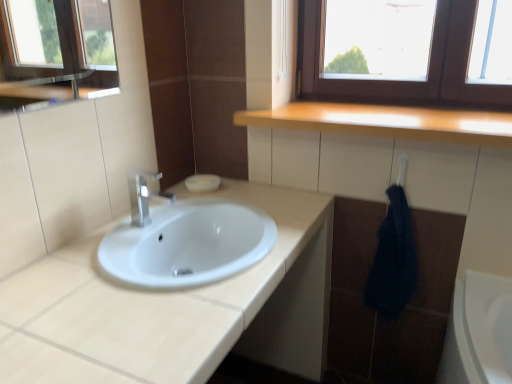
Where is `satin nickel faucet at center`? The height and width of the screenshot is (384, 512). satin nickel faucet at center is located at coordinates (144, 195).

What is the approximate width of light wood countertop at upper center?

It is 40.02 centimeters.

Locate an element on the screen. This screenshot has width=512, height=384. dark blue textured towel at right is located at coordinates (393, 260).

Is white glossy sink at center oriented towards satin nickel faucet at center?

No, white glossy sink at center is not turned towards satin nickel faucet at center.

Can you confirm if white glossy sink at center is bigger than satin nickel faucet at center?

Indeed, white glossy sink at center has a larger size compared to satin nickel faucet at center.

Which object is thinner, white glossy sink at center or satin nickel faucet at center?

satin nickel faucet at center.

Which is closer, (403, 298) or (140, 199)?

Point (403, 298) is farther from the camera than point (140, 199).

Can you confirm if dark blue textured towel at right is positioned to the left of satin nickel faucet at center?

No.

From the image's perspective, is dark blue textured towel at right above satin nickel faucet at center?

Incorrect, from the image's perspective, dark blue textured towel at right is lower than satin nickel faucet at center.

Is dark blue textured towel at right at the back of light wood countertop at upper center?

No, light wood countertop at upper center is not facing away from dark blue textured towel at right.

Who is taller, light wood countertop at upper center or dark blue textured towel at right?

dark blue textured towel at right is taller.

Is dark blue textured towel at right inside light wood countertop at upper center?

No, light wood countertop at upper center does not contain dark blue textured towel at right.

The height and width of the screenshot is (384, 512). I want to click on bath towel located behind the light wood countertop at upper center, so click(x=393, y=260).

Considering the relative positions of white glossy sink at center and light wood countertop at upper center in the image provided, is white glossy sink at center in front of light wood countertop at upper center?

Yes, it is in front of light wood countertop at upper center.

Who is smaller, white glossy sink at center or light wood countertop at upper center?

Smaller between the two is light wood countertop at upper center.

Between point (311, 351) and point (493, 118), which one is positioned in front?

The point (493, 118) is closer.

From a real-world perspective, between white glossy sink at center and light wood countertop at upper center, who is vertically higher?

In real-world perspective, light wood countertop at upper center is above.

Is satin nickel faucet at center inside the boundaries of light wood countertop at upper center, or outside?

satin nickel faucet at center lies outside light wood countertop at upper center.

Is satin nickel faucet at center next to light wood countertop at upper center and touching it?

No, satin nickel faucet at center is not with light wood countertop at upper center.

Who is more distant, satin nickel faucet at center or light wood countertop at upper center?

satin nickel faucet at center.

In the scene shown: Is light wood countertop at upper center bigger than satin nickel faucet at center?

Yes.

The width and height of the screenshot is (512, 384). What are the coordinates of `countertop in front of the satin nickel faucet at center` in the screenshot? It's located at point(387,122).

How much distance is there between light wood countertop at upper center and satin nickel faucet at center?

light wood countertop at upper center and satin nickel faucet at center are 27.84 inches apart.

How different are the orientations of light wood countertop at upper center and satin nickel faucet at center in degrees?

They differ by 88.7 degrees in their facing directions.

From the image's perspective, is light wood countertop at upper center located beneath white glossy sink at center?

No.

What's the angular difference between light wood countertop at upper center and white glossy sink at center's facing directions?

89.8 degrees.

Is light wood countertop at upper center taller or shorter than white glossy sink at center?

light wood countertop at upper center is shorter than white glossy sink at center.

The width and height of the screenshot is (512, 384). I want to click on bathroom cabinet directly beneath the light wood countertop at upper center (from a real-world perspective), so click(175, 308).

You are a GUI agent. You are given a task and a screenshot of the screen. Output one action in this format:
    pyautogui.click(x=<x>, y=<y>)
    Task: Click on the bathroom cabinet below the satin nickel faucet at center (from a real-world perspective)
    Image resolution: width=512 pixels, height=384 pixels.
    Given the screenshot: What is the action you would take?
    pyautogui.click(x=175, y=308)

Locate an element on the screen. This screenshot has height=384, width=512. bath towel that is below the satin nickel faucet at center (from the image's perspective) is located at coordinates (393, 260).

Looking at the image, which one is located further to light wood countertop at upper center, white glossy sink at center or dark blue textured towel at right?

white glossy sink at center.

Considering their positions, is white glossy sink at center positioned closer to light wood countertop at upper center than satin nickel faucet at center?

white glossy sink at center is closer to light wood countertop at upper center.

In the scene shown: Which object lies further to the anchor point white glossy sink at center, satin nickel faucet at center or dark blue textured towel at right?

dark blue textured towel at right is further to white glossy sink at center.

Considering their positions, is light wood countertop at upper center positioned further to white glossy sink at center than satin nickel faucet at center?

light wood countertop at upper center lies further to white glossy sink at center than the other object.

Estimate the real-world distances between objects in this image. Which object is further from white glossy sink at center, satin nickel faucet at center or light wood countertop at upper center?

light wood countertop at upper center.

When comparing their distances from light wood countertop at upper center, does satin nickel faucet at center or dark blue textured towel at right seem further?

The object further to light wood countertop at upper center is satin nickel faucet at center.

Based on their spatial positions, is light wood countertop at upper center or satin nickel faucet at center closer to dark blue textured towel at right?

The object closer to dark blue textured towel at right is light wood countertop at upper center.

Based on their spatial positions, is light wood countertop at upper center or dark blue textured towel at right further from satin nickel faucet at center?

Based on the image, dark blue textured towel at right appears to be further to satin nickel faucet at center.

You are a GUI agent. You are given a task and a screenshot of the screen. Output one action in this format:
    pyautogui.click(x=<x>, y=<y>)
    Task: Click on the countertop located between white glossy sink at center and dark blue textured towel at right in the left-right direction
    The image size is (512, 384).
    Given the screenshot: What is the action you would take?
    pyautogui.click(x=387, y=122)

What are the coordinates of `bathroom cabinet situated between satin nickel faucet at center and light wood countertop at upper center from left to right` in the screenshot? It's located at (175, 308).

The image size is (512, 384). What are the coordinates of `bathroom cabinet between satin nickel faucet at center and dark blue textured towel at right in the horizontal direction` in the screenshot? It's located at (175, 308).

The height and width of the screenshot is (384, 512). In order to click on countertop between satin nickel faucet at center and dark blue textured towel at right in this screenshot , I will do pyautogui.click(x=387, y=122).